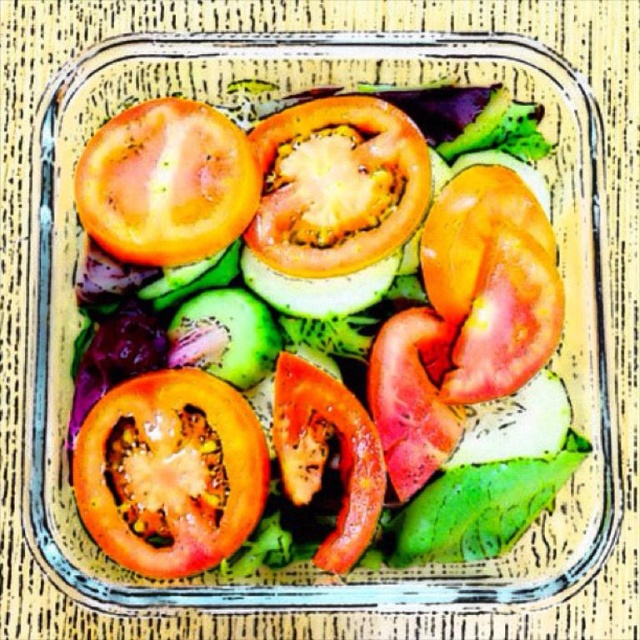
Question: Is juicy tomato slices at center positioned behind juicy red tomato at upper left?

Choices:
 (A) no
 (B) yes

Answer: (A)

Question: Which of the following is the farthest from the observer?

Choices:
 (A) juicy red tomato at upper left
 (B) red matte tomato at lower left
 (C) shiny red tomato at center

Answer: (C)

Question: Considering the relative positions of juicy tomato slices at center and shiny red tomato at center in the image provided, where is juicy tomato slices at center located with respect to shiny red tomato at center?

Choices:
 (A) right
 (B) left

Answer: (B)

Question: Which of the following is the farthest from the observer?

Choices:
 (A) (228, 394)
 (B) (252, 230)
 (C) (172, 180)

Answer: (B)

Question: Which point is closer to the camera?

Choices:
 (A) (154, 556)
 (B) (403, 234)
 (C) (202, 250)
 (D) (324, 147)

Answer: (A)

Question: From the image, what is the correct spatial relationship of red matte tomato at lower left in relation to juicy red tomato at upper left?

Choices:
 (A) below
 (B) above

Answer: (A)